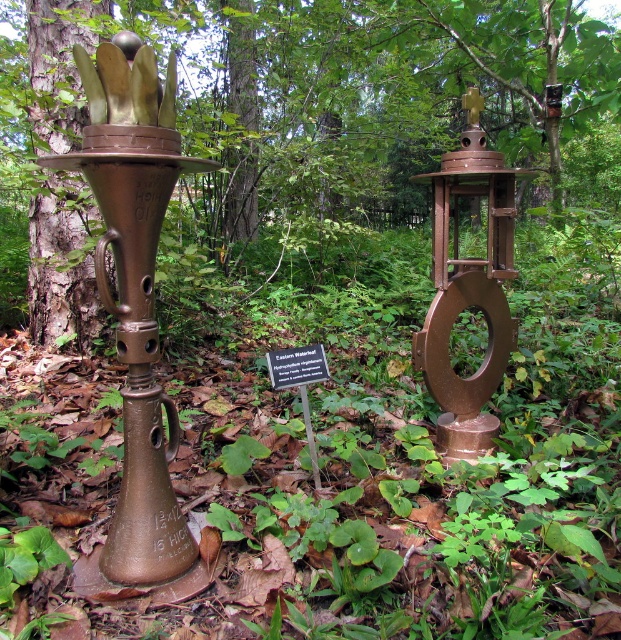
Can you confirm if brushed metal tree at center is positioned to the right of bronze/metallic torch at center?

Yes, brushed metal tree at center is to the right of bronze/metallic torch at center.

Does brushed metal tree at center have a greater width compared to bronze/metallic torch at center?

Indeed, brushed metal tree at center has a greater width compared to bronze/metallic torch at center.

The image size is (621, 640). Describe the element at coordinates (340, 113) in the screenshot. I see `brushed metal tree at center` at that location.

Find the location of `brushed metal tree at center`. brushed metal tree at center is located at coordinates (340, 113).